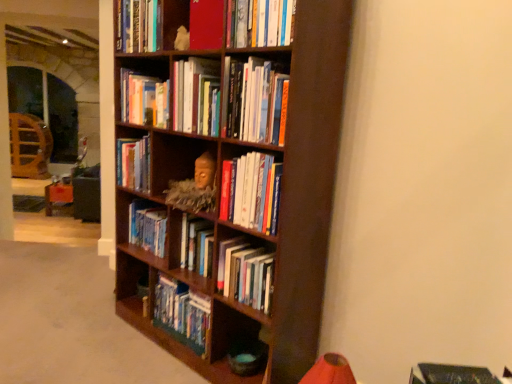
Question: Considering the positions of hardcover books at center, which is the eighth book from top to bottom, and hardcover books at center, arranged as the 6th book when ordered from the bottom, in the image, is hardcover books at center, which is the eighth book from top to bottom, taller or shorter than hardcover books at center, arranged as the 6th book when ordered from the bottom,?

Choices:
 (A) tall
 (B) short

Answer: (B)

Question: In terms of width, does hardcover books at center, which is the eighth book from top to bottom, look wider or thinner when compared to hardcover books at center, the fifth book positioned from the top?

Choices:
 (A) thin
 (B) wide

Answer: (A)

Question: Which is nearer to the hardcover books at center, placed as the fourth book when sorted from bottom to top?

Choices:
 (A) hardcover books at upper center, arranged as the 6th book when viewed from the top
 (B) hardcover book at upper center, the eighth book when ordered from bottom to top
 (C) matte red book at upper center, which is counted as the 9th book, starting from the bottom
 (D) hardcover books at center, the 7th book ordered from the bottom
 (E) hardcover book at center, the 9th book in the top-to-bottom sequence

Answer: (A)

Question: Considering the real-world distances, which object is farthest from the hardcover books at center, arranged as the 6th book when ordered from the bottom?

Choices:
 (A) hardcover books at center, placed as the fourth book when sorted from bottom to top
 (B) hardcover books at center, the 3th book positioned from the bottom
 (C) hardcover books at center, the tenth book from the top
 (D) white plush toy at upper center
 (E) hardcover book at upper center, the first book viewed from the top

Answer: (C)